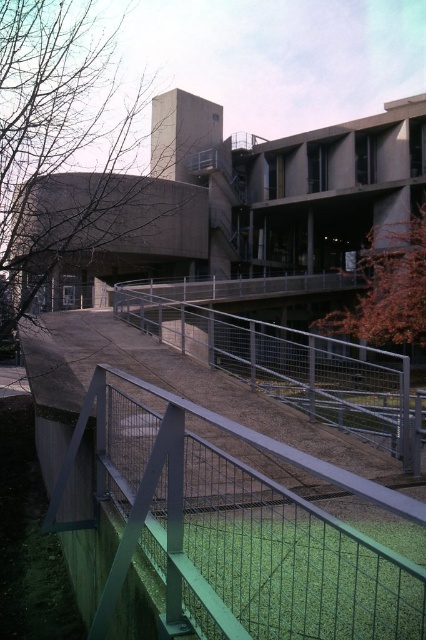
Can you confirm if green wire mesh fence at center is shorter than brown leafy tree at upper left?

Correct, green wire mesh fence at center is not as tall as brown leafy tree at upper left.

Is point (221, 480) farther from viewer compared to point (49, 74)?

No, it is not.

This screenshot has width=426, height=640. In order to click on green wire mesh fence at center in this screenshot , I will do `click(238, 529)`.

Is brown leafy tree at upper left behind metal mesh fence at center?

That is True.

Is point (46, 145) positioned after point (276, 330)?

No, it is not.

You are a GUI agent. You are given a task and a screenshot of the screen. Output one action in this format:
    pyautogui.click(x=<x>, y=<y>)
    Task: Click on the brown leafy tree at upper left
    The height and width of the screenshot is (640, 426).
    Given the screenshot: What is the action you would take?
    pyautogui.click(x=63, y=150)

At what (x,y) coordinates should I click in order to perform the action: click on brown leafy tree at upper left. Please return your answer as a coordinate pair (x, y). Looking at the image, I should click on (63, 150).

Is point (180, 444) in front of point (385, 436)?

Yes, it is in front of point (385, 436).

Between green wire mesh fence at center and metal mesh fence at center, which one is positioned higher?

Positioned higher is green wire mesh fence at center.

Who is more forward, (167,460) or (249,378)?

Positioned in front is point (167,460).

Locate an element on the screen. This screenshot has height=640, width=426. green wire mesh fence at center is located at coordinates (238, 529).